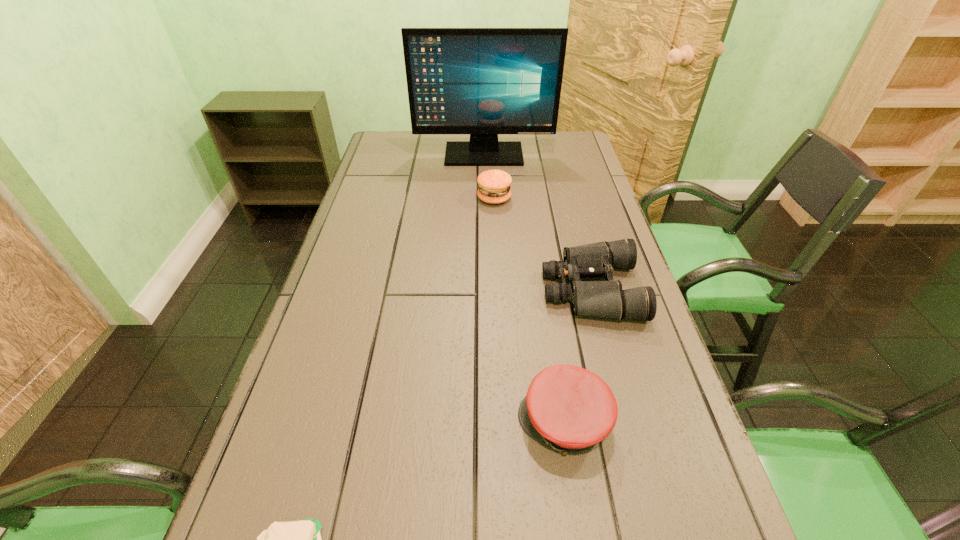
Locate an element on the screen. object located at the far right corner is located at coordinates (480, 81).

At what (x,y) coordinates should I click in order to perform the action: click on vacant space at the far edge of the desktop. Please return your answer as a coordinate pair (x, y). Looking at the image, I should click on (422, 134).

Where is `free space at the left edge of the desktop`? free space at the left edge of the desktop is located at coordinates tap(307, 424).

In the image, there is a desktop. At what (x,y) coordinates should I click in order to perform the action: click on vacant region at the right edge. Please return your answer as a coordinate pair (x, y). The width and height of the screenshot is (960, 540). Looking at the image, I should click on (582, 281).

Locate an element on the screen. This screenshot has height=540, width=960. vacant area at the far left corner is located at coordinates (415, 139).

The width and height of the screenshot is (960, 540). In order to click on vacant space that's between the second nearest object and the third nearest object in this screenshot , I will do `click(578, 356)`.

The image size is (960, 540). I want to click on vacant region between the third farthest object and the tallest object, so click(538, 222).

You are a GUI agent. You are given a task and a screenshot of the screen. Output one action in this format:
    pyautogui.click(x=<x>, y=<y>)
    Task: Click on the free spot between the second nearest object and the third nearest object
    
    Given the screenshot: What is the action you would take?
    pyautogui.click(x=578, y=356)

I want to click on vacant region between the cap and the tallest object, so click(x=524, y=289).

Locate an element on the screen. The height and width of the screenshot is (540, 960). object that stands as the closest to the right patty is located at coordinates (480, 81).